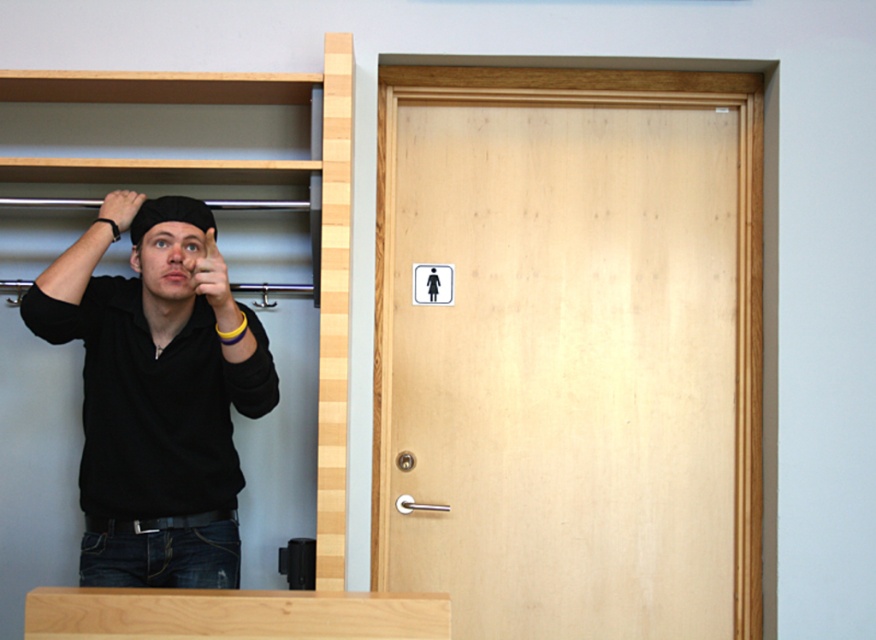
Which is in front, point (131, 520) or point (154, 200)?

Point (154, 200)

Identify the location of black matte shirt at upper left. (154, 403).

Who is positioned more to the left, matte black hat at upper left or black matte wristband at upper left?

black matte wristband at upper left is more to the left.

Who is higher up, matte black hat at upper left or black matte wristband at upper left?

black matte wristband at upper left

Is point (208, 225) positioned after point (101, 216)?

No, (208, 225) is in front of (101, 216).

The image size is (876, 640). I want to click on matte black hat at upper left, so click(x=168, y=216).

Does matte black hand at upper center lie in front of matte black hat at upper left?

Yes, it is.

Measure the distance between point (227,300) and camera.

They are 8.25 feet apart.

Which is behind, point (205, 243) or point (133, 230)?

Positioned behind is point (133, 230).

This screenshot has height=640, width=876. What are the coordinates of `matte black hand at upper center` in the screenshot? It's located at (210, 278).